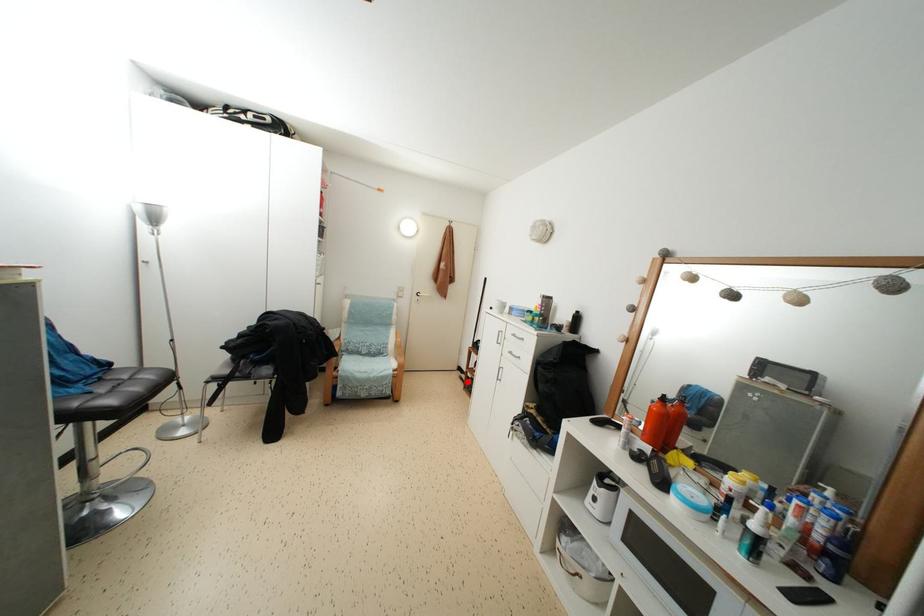
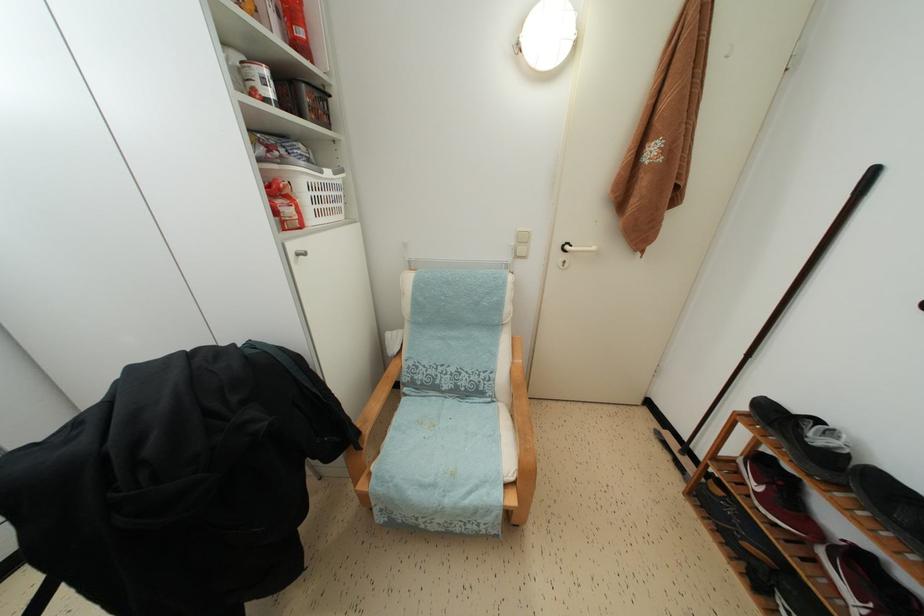
Question: I am providing you with two images of the same scene from different viewpoints. A red point is shown in image1. For the corresponding object point in image2, is it positioned nearer or farther from the camera?

Choices:
 (A) Nearer
 (B) Farther

Answer: (A)